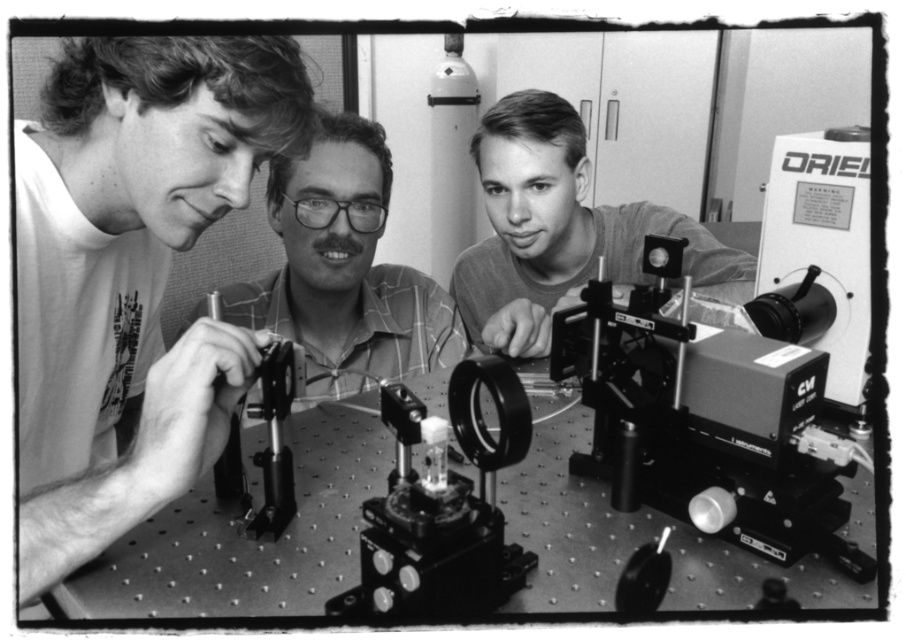
Who is positioned more to the right, plaid shirt at center or smooth plastic camera at center?

smooth plastic camera at center is more to the right.

Who is shorter, plaid shirt at center or smooth plastic camera at center?

Standing shorter between the two is plaid shirt at center.

Locate an element on the screen. plaid shirt at center is located at coordinates (344, 269).

Does plaid shirt at center appear under metallic silver lens at lower right?

No.

Is point (307, 337) positioned before point (699, 524)?

No, it is not.

Image resolution: width=906 pixels, height=640 pixels. I want to click on plaid shirt at center, so click(344, 269).

Does plaid shirt at center lie in front of metallic black lens at center?

No, it is not.

Which is more to the left, plaid shirt at center or metallic black lens at center?

Positioned to the left is plaid shirt at center.

Where is `plaid shirt at center`? The width and height of the screenshot is (906, 640). plaid shirt at center is located at coordinates (344, 269).